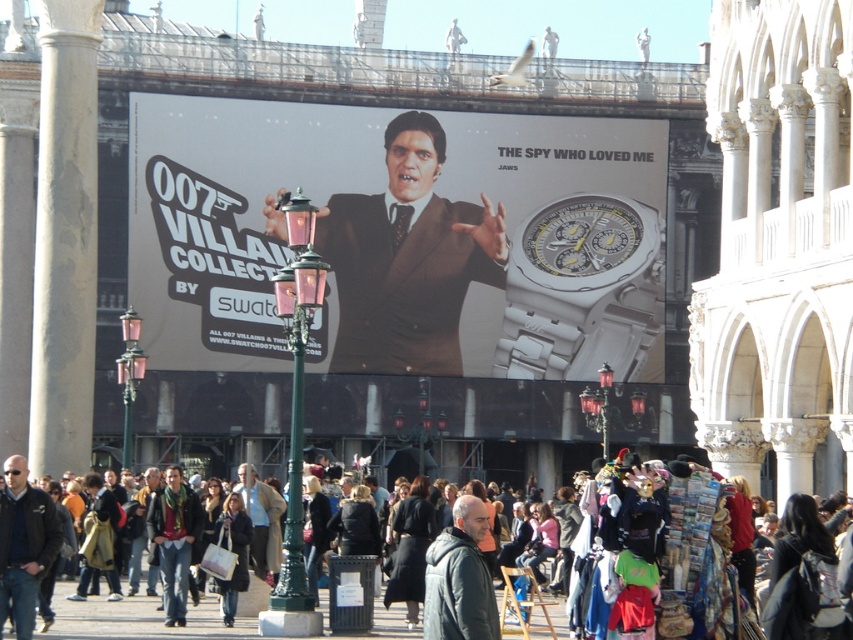
Is point (412, 198) farther from viewer compared to point (148, 525)?

Yes, point (412, 198) is behind point (148, 525).

Between matte brown suit at center and dark brown leather jacket at center, which one is positioned higher?

A: Positioned higher is matte brown suit at center.

Between point (399, 333) and point (56, 488), which one is positioned in front?

Point (56, 488) is in front.

Find the location of `matte brown suit at center`. matte brown suit at center is located at coordinates coord(407,259).

How distant is white metallic watch at center from gray stone column at left?

white metallic watch at center and gray stone column at left are 92.78 feet apart.

Locate an element on the screen. The image size is (853, 640). white metallic watch at center is located at coordinates (399, 237).

Between point (424, 134) and point (55, 140), which one is positioned behind?

The point (424, 134) is behind.

The height and width of the screenshot is (640, 853). What are the coordinates of `white metallic watch at center` in the screenshot? It's located at (399, 237).

How much distance is there between gray stone column at left and dark blue leather jacket at lower left?

gray stone column at left is 26.65 meters from dark blue leather jacket at lower left.

Is point (74, 68) positioned after point (7, 536)?

Yes.

Locate an element on the screen. gray stone column at left is located at coordinates (64, 237).